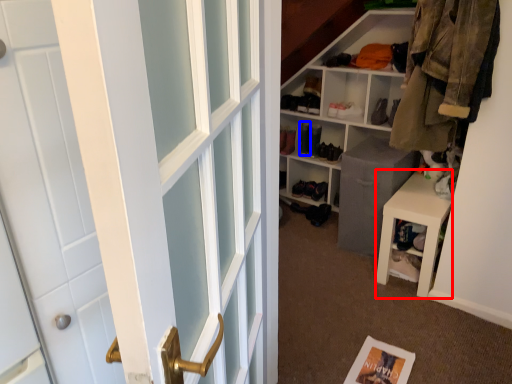
Question: Which point is closer to the camera, stool (highlighted by a red box) or shoe (highlighted by a blue box)?

Choices:
 (A) stool
 (B) shoe

Answer: (A)